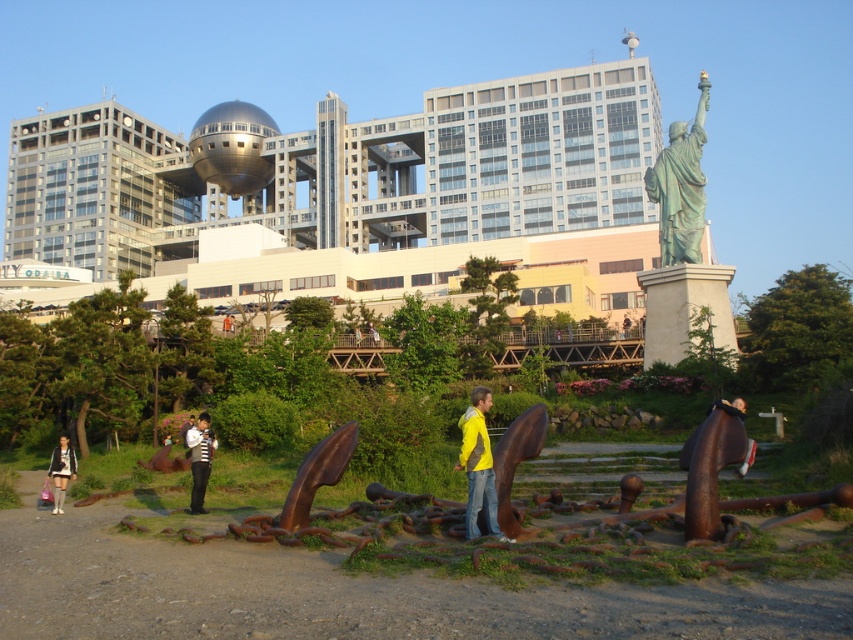
Is green patina statue at upper right above white striped shirt at center?

Correct, green patina statue at upper right is located above white striped shirt at center.

Consider the image. Can you confirm if green patina statue at upper right is thinner than white striped shirt at center?

In fact, green patina statue at upper right might be wider than white striped shirt at center.

Where is `green patina statue at upper right`? This screenshot has width=853, height=640. green patina statue at upper right is located at coordinates (680, 186).

Identify the location of green patina statue at upper right. (680, 186).

Between point (490, 531) and point (204, 467), which one is positioned in front?

Point (490, 531) is more forward.

Is point (473, 477) positioned in front of point (198, 433)?

Yes.

The height and width of the screenshot is (640, 853). Find the location of `yellow matte jacket at center`. yellow matte jacket at center is located at coordinates (479, 467).

Measure the distance between green patina statue at upper right and camera.

green patina statue at upper right is 53.57 meters away from camera.

Is green patina statue at upper right below matte black dress at lower left?

Incorrect, green patina statue at upper right is not positioned below matte black dress at lower left.

Between point (695, 124) and point (67, 456), which one is positioned behind?

Positioned behind is point (695, 124).

Identify the location of green patina statue at upper right. This screenshot has height=640, width=853. (680, 186).